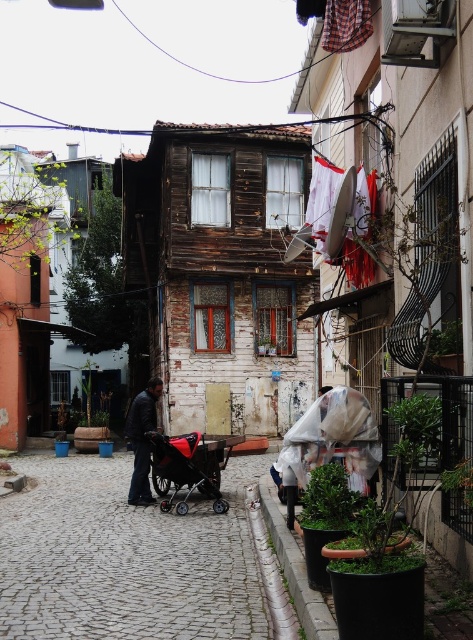
Question: In this image, where is red matte baby carriage at center located relative to dark gray fabric jacket at center?

Choices:
 (A) right
 (B) left

Answer: (A)

Question: Which object is the farthest from the red fabric stroller at center?

Choices:
 (A) red matte baby carriage at center
 (B) dark gray fabric jacket at center

Answer: (B)

Question: Does red fabric stroller at center appear over dark gray fabric jacket at center?

Choices:
 (A) yes
 (B) no

Answer: (B)

Question: Which of the following is the closest to the observer?

Choices:
 (A) (159, 449)
 (B) (238, 634)

Answer: (B)

Question: Is red fabric stroller at center smaller than red matte baby carriage at center?

Choices:
 (A) no
 (B) yes

Answer: (A)

Question: Which of the following is the farthest from the observer?

Choices:
 (A) (47, 484)
 (B) (136, 420)
 (C) (185, 480)

Answer: (A)